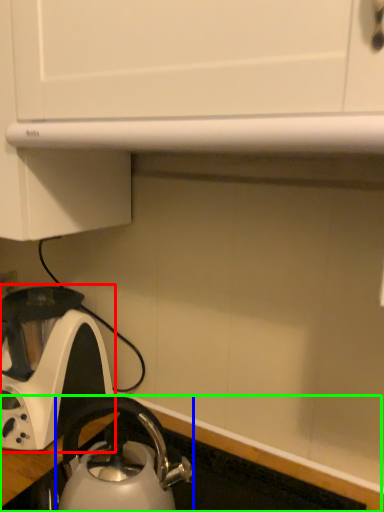
Question: Based on their relative distances, which object is nearer to kettle (highlighted by a red box)? Choose from kettle (highlighted by a blue box) and counter top (highlighted by a green box).

Choices:
 (A) kettle
 (B) counter top

Answer: (A)